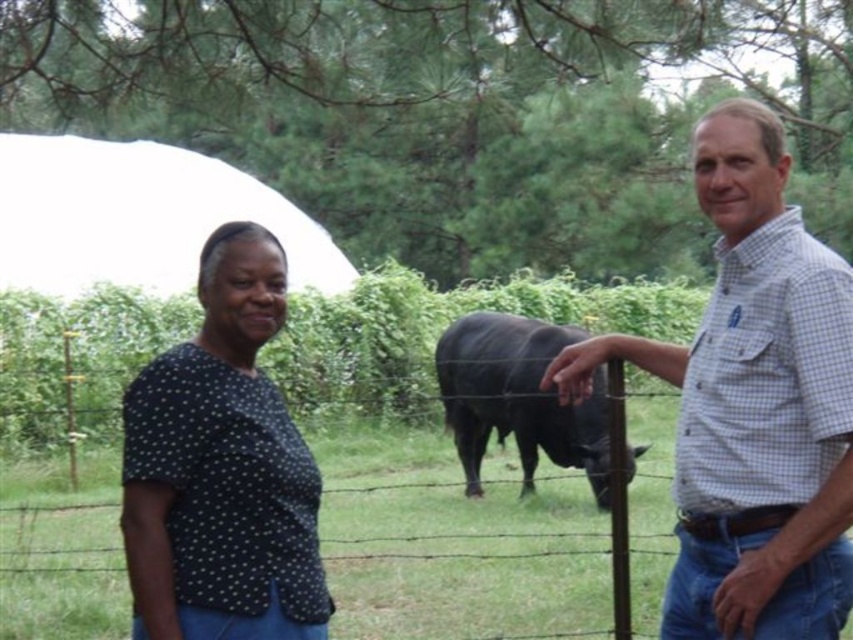
You are standing at the point labeled as point (727, 451) in the image. The distance between you and the viewer is 9.58 feet. If you want to move closer to the viewer by 3 feet, how far will you be from the viewer then?

After moving closer by 3 feet, you will be 6.58 feet away from the viewer.

You are a photographer trying to capture a photo of the white checkered shirt at right. You notice that the camera focus point is currently set at point (753, 404). Will this focus point be sufficient to capture the white checkered shirt at right clearly?

Yes, because the white checkered shirt at right is located at point (753, 404), so the focus point is directly on it.

Consider the image. You are a photographer trying to capture both the black dotted shirt at center and the black glossy bull at center in a single frame. Based on their heights, which one will appear larger in the photo?

The black glossy bull at center will appear larger in the photo because it is taller than the black dotted shirt at center.